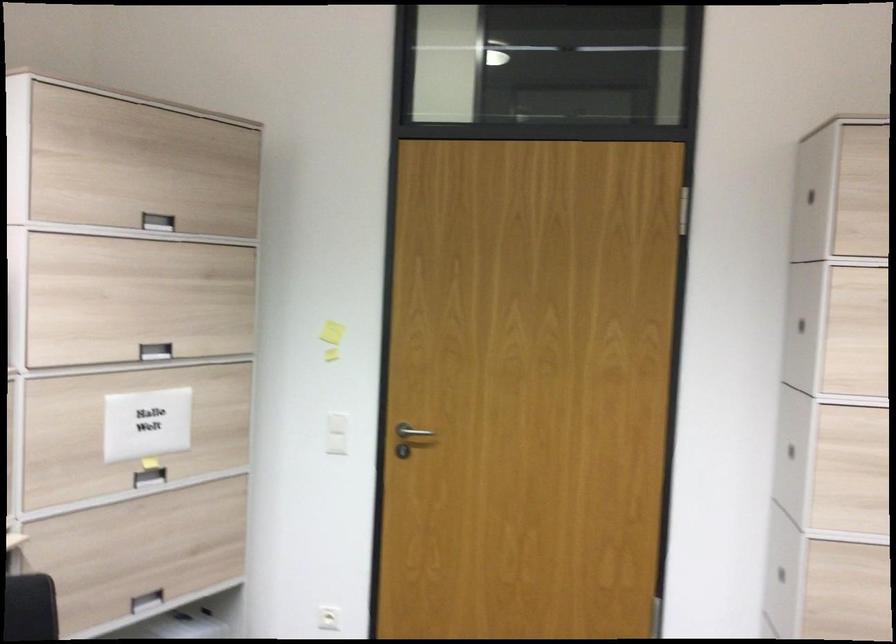
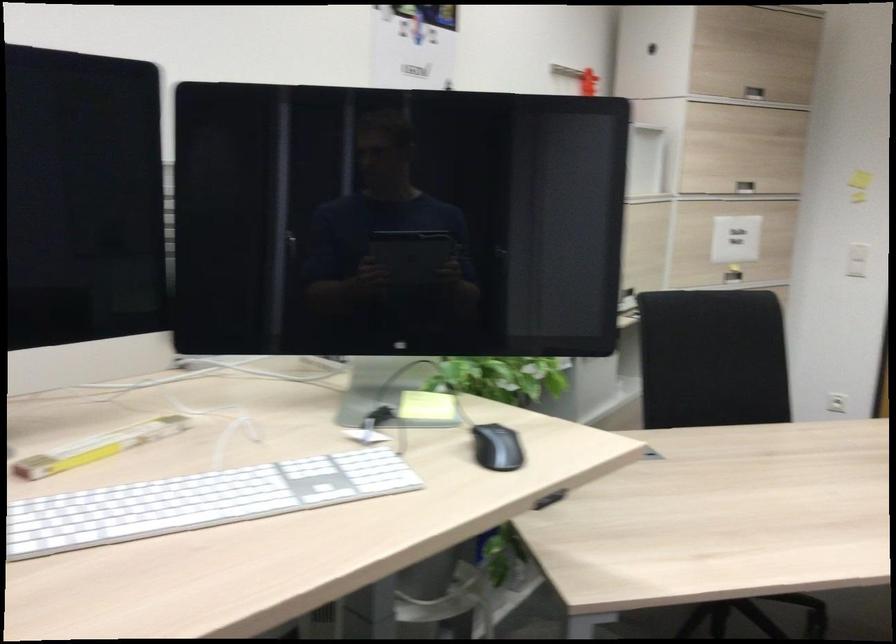
The point at (135, 355) is marked in the first image. Where is the corresponding point in the second image?

(745, 187)